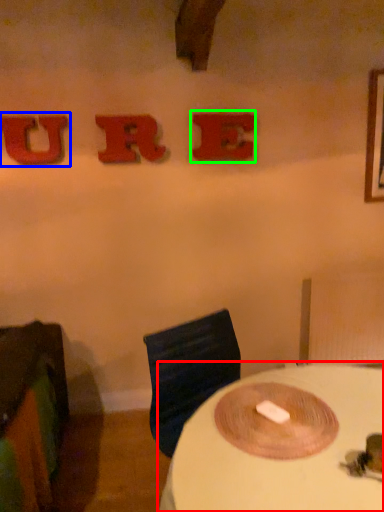
Question: Based on their relative distances, which object is farther from table (highlighted by a red box)? Choose from alphabet (highlighted by a blue box) and alphabet (highlighted by a green box).

Choices:
 (A) alphabet
 (B) alphabet

Answer: (A)